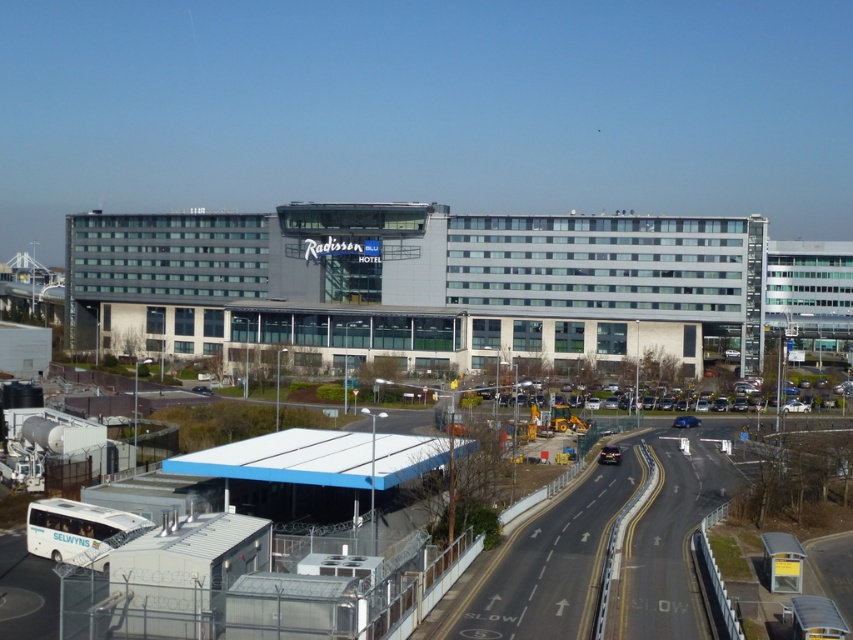
Question: Where is white matte bus station at lower left located in relation to white matte bus at lower left in the image?

Choices:
 (A) below
 (B) above

Answer: (B)

Question: Among these points, which one is nearest to the camera?

Choices:
 (A) (303, 438)
 (B) (67, 538)
 (C) (410, 310)

Answer: (B)

Question: Can you confirm if white matte bus station at lower left is positioned to the right of white matte bus at lower left?

Choices:
 (A) no
 (B) yes

Answer: (B)

Question: In this image, where is gray concrete radisson blu hotel at center located relative to white matte bus station at lower left?

Choices:
 (A) right
 (B) left

Answer: (B)

Question: Which object is farther from the camera taking this photo?

Choices:
 (A) gray concrete radisson blu hotel at center
 (B) white matte bus station at lower left

Answer: (A)

Question: Which point appears closest to the camera in this image?

Choices:
 (A) (225, 220)
 (B) (45, 545)
 (C) (254, 477)

Answer: (B)